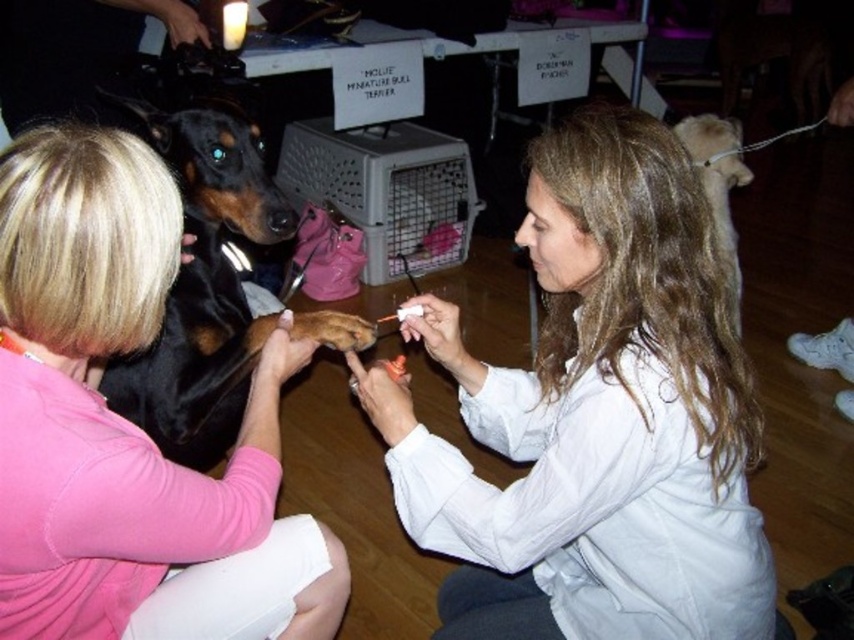
Is point (588, 365) positioned behind point (91, 346)?

Yes, point (588, 365) is farther from viewer.

The width and height of the screenshot is (854, 640). In order to click on smooth white coat at center in this screenshot , I will do `click(595, 417)`.

Between smooth white coat at center and light brown fur at right, which one is positioned lower?

smooth white coat at center is lower down.

Between point (364, 397) and point (705, 177), which one is positioned behind?

Point (705, 177)

Does point (607, 294) lie in front of point (730, 307)?

Yes, it is.

Locate an element on the screen. The image size is (854, 640). smooth white coat at center is located at coordinates (595, 417).

Measure the distance between point (x=202, y=214) and camera.

5.18 feet

Between black shiny fur at center and light brown fur at right, which one is positioned lower?

black shiny fur at center

Is point (232, 390) behind point (730, 289)?

No, it is in front of (730, 289).

Locate an element on the screen. Image resolution: width=854 pixels, height=640 pixels. black shiny fur at center is located at coordinates (202, 284).